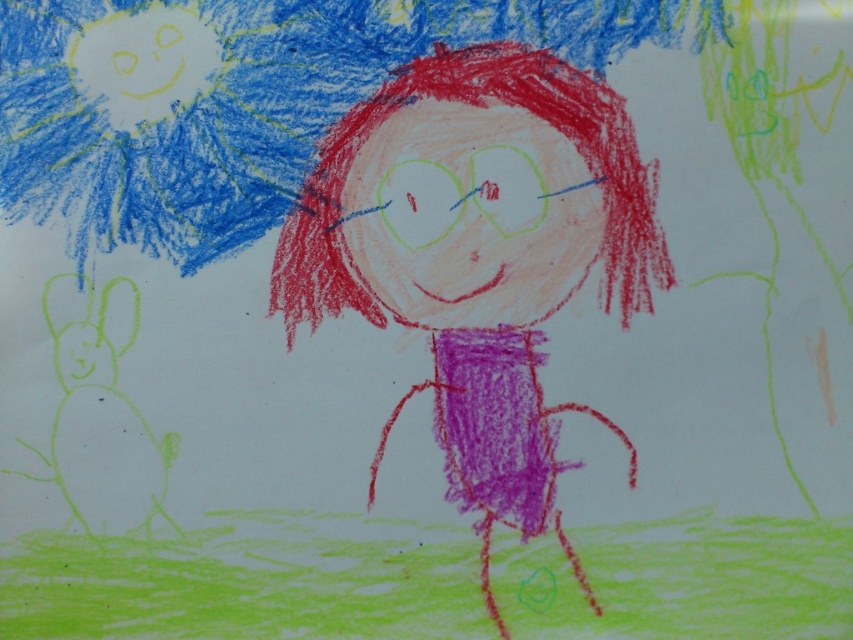
Consider the image. Is smooth purple dress at center below blue textured umbrella at upper left?

Yes.

Can you confirm if smooth purple dress at center is taller than blue textured umbrella at upper left?

Correct, smooth purple dress at center is much taller as blue textured umbrella at upper left.

Does point (471, 490) come behind point (257, 228)?

That is False.

You are a GUI agent. You are given a task and a screenshot of the screen. Output one action in this format:
    pyautogui.click(x=<x>, y=<y>)
    Task: Click on the smooth purple dress at center
    Image resolution: width=853 pixels, height=640 pixels.
    Given the screenshot: What is the action you would take?
    pyautogui.click(x=479, y=253)